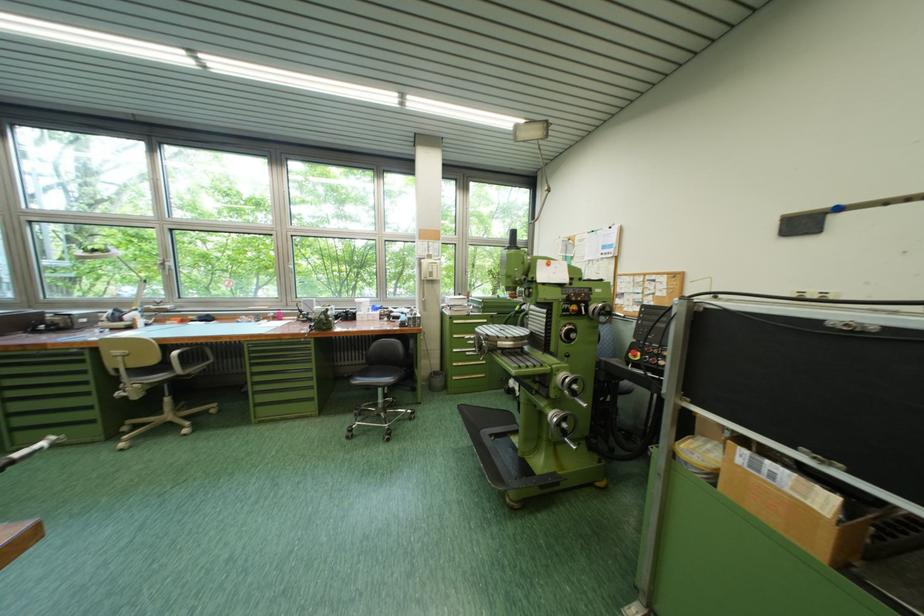
What do you see at coordinates (179, 358) in the screenshot?
I see `the chair armrest` at bounding box center [179, 358].